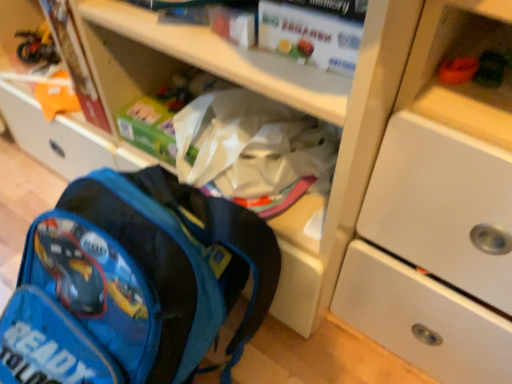
Where is `white matte paper at upper center, marked as the 2th paperback book in a left-to-right arrangement`? white matte paper at upper center, marked as the 2th paperback book in a left-to-right arrangement is located at coordinates (312, 32).

Measure the distance between point (480, 81) and camera.

They are 20.08 inches apart.

The height and width of the screenshot is (384, 512). Find the location of `white matte cabinet at upper right`. white matte cabinet at upper right is located at coordinates (440, 209).

This screenshot has width=512, height=384. What do you see at coordinates (76, 60) in the screenshot? I see `matte cardboard book at upper left, marked as the 2th paperback book in a front-to-back arrangement` at bounding box center [76, 60].

Locate an element on the screen. The image size is (512, 384). blue fabric backpack at lower left is located at coordinates (134, 283).

This screenshot has width=512, height=384. What do you see at coordinates (134, 283) in the screenshot?
I see `blue fabric backpack at lower left` at bounding box center [134, 283].

Locate an element on the screen. This screenshot has height=384, width=512. white matte paper at upper center, marked as the 2th paperback book in a left-to-right arrangement is located at coordinates (312, 32).

From the image's perspective, is matte cardboard book at upper left, the second paperback book viewed from the right, located above or below white matte paper at upper center, arranged as the 2th paperback book when viewed from the back?

matte cardboard book at upper left, the second paperback book viewed from the right, is above white matte paper at upper center, arranged as the 2th paperback book when viewed from the back.

Measure the distance between matte cardboard book at upper left, which ranks as the first paperback book in back-to-front order, and white matte paper at upper center, the 1th paperback book from the right.

14.28 inches.

Considering the relative sizes of matte cardboard book at upper left, marked as the 2th paperback book in a front-to-back arrangement, and white matte paper at upper center, the 1th paperback book from the right, in the image provided, is matte cardboard book at upper left, marked as the 2th paperback book in a front-to-back arrangement, bigger than white matte paper at upper center, the 1th paperback book from the right,?

Indeed, matte cardboard book at upper left, marked as the 2th paperback book in a front-to-back arrangement, has a larger size compared to white matte paper at upper center, the 1th paperback book from the right.

Is the surface of matte cardboard book at upper left, acting as the first paperback book starting from the left, in direct contact with white matte paper at upper center, the 1th paperback book from the right?

No, matte cardboard book at upper left, acting as the first paperback book starting from the left, is not next to white matte paper at upper center, the 1th paperback book from the right.

Between matte cardboard book at upper left, the second paperback book viewed from the right, and green fuzzy toy at upper right, which one is positioned in front?

green fuzzy toy at upper right is more forward.

In the scene shown: Is matte cardboard book at upper left, marked as the 2th paperback book in a front-to-back arrangement, touching green fuzzy toy at upper right?

No, matte cardboard book at upper left, marked as the 2th paperback book in a front-to-back arrangement, is not beside green fuzzy toy at upper right.

Is matte cardboard book at upper left, which ranks as the first paperback book in back-to-front order, to the left of green fuzzy toy at upper right from the viewer's perspective?

Yes, matte cardboard book at upper left, which ranks as the first paperback book in back-to-front order, is to the left of green fuzzy toy at upper right.

Is blue fabric backpack at lower left positioned far away from white matte cabinet at upper right?

No.

Is blue fabric backpack at lower left located outside white matte cabinet at upper right?

Yes, blue fabric backpack at lower left is not within white matte cabinet at upper right.

From the image's perspective, between blue fabric backpack at lower left and white matte cabinet at upper right, who is located below?

blue fabric backpack at lower left, from the image's perspective.

This screenshot has height=384, width=512. There is a blue fabric backpack at lower left. Find the location of `cabinetry above it (from a real-world perspective)`. cabinetry above it (from a real-world perspective) is located at coordinates (440, 209).

Looking at their sizes, would you say white matte paper at upper center, the first paperback book when ordered from front to back, is wider or thinner than green fuzzy toy at upper right?

In the image, white matte paper at upper center, the first paperback book when ordered from front to back, appears to be more narrow than green fuzzy toy at upper right.

Considering the points (355, 61) and (486, 73), which point is in front, point (355, 61) or point (486, 73)?

Positioned in front is point (355, 61).

Between white matte paper at upper center, the 1th paperback book from the right, and green fuzzy toy at upper right, which one has larger size?

Bigger between the two is white matte paper at upper center, the 1th paperback book from the right.

In terms of size, does white matte paper at upper center, arranged as the 2th paperback book when viewed from the back, appear bigger or smaller than matte cardboard book at upper left, the second paperback book viewed from the right?

Clearly, white matte paper at upper center, arranged as the 2th paperback book when viewed from the back, is smaller in size than matte cardboard book at upper left, the second paperback book viewed from the right.

Which is in front, point (262, 11) or point (87, 63)?

The point (262, 11) is more forward.

Is white matte paper at upper center, the 1th paperback book from the right, taller or shorter than matte cardboard book at upper left, marked as the 2th paperback book in a front-to-back arrangement?

In the image, white matte paper at upper center, the 1th paperback book from the right, appears to be shorter than matte cardboard book at upper left, marked as the 2th paperback book in a front-to-back arrangement.

Could you measure the distance between white matte paper at upper center, marked as the 2th paperback book in a left-to-right arrangement, and matte cardboard book at upper left, marked as the 2th paperback book in a front-to-back arrangement?

They are 14.28 inches apart.

Which is more to the right, green fuzzy toy at upper right or matte cardboard book at upper left, which ranks as the first paperback book in back-to-front order?

Positioned to the right is green fuzzy toy at upper right.

Is green fuzzy toy at upper right aimed at matte cardboard book at upper left, which ranks as the first paperback book in back-to-front order?

No.

Which object is closer to the camera, green fuzzy toy at upper right or matte cardboard book at upper left, acting as the first paperback book starting from the left?

green fuzzy toy at upper right is in front.

From the picture: From the image's perspective, which one is positioned higher, blue fabric backpack at lower left or white matte paper at upper center, the 1th paperback book from the right?

white matte paper at upper center, the 1th paperback book from the right, is shown above in the image.

Does blue fabric backpack at lower left lie in front of white matte paper at upper center, arranged as the 2th paperback book when viewed from the back?

That is True.

Could you measure the distance between blue fabric backpack at lower left and white matte paper at upper center, the first paperback book when ordered from front to back?

The distance of blue fabric backpack at lower left from white matte paper at upper center, the first paperback book when ordered from front to back, is 14.56 inches.

Is blue fabric backpack at lower left oriented towards white matte paper at upper center, the 1th paperback book from the right?

No, blue fabric backpack at lower left is not turned towards white matte paper at upper center, the 1th paperback book from the right.

Where is `paperback book to the right of matte cardboard book at upper left, which ranks as the first paperback book in back-to-front order`? This screenshot has width=512, height=384. paperback book to the right of matte cardboard book at upper left, which ranks as the first paperback book in back-to-front order is located at coordinates (312, 32).

Find the location of a particular element. paperback book beneath the green fuzzy toy at upper right (from a real-world perspective) is located at coordinates (76, 60).

Based on their spatial positions, is green fuzzy toy at upper right or matte cardboard book at upper left, acting as the first paperback book starting from the left, closer to white matte paper at upper center, marked as the 2th paperback book in a left-to-right arrangement?

green fuzzy toy at upper right lies closer to white matte paper at upper center, marked as the 2th paperback book in a left-to-right arrangement, than the other object.

Considering their positions, is white matte cabinet at upper right positioned closer to blue fabric backpack at lower left than green fuzzy toy at upper right?

Based on the image, white matte cabinet at upper right appears to be nearer to blue fabric backpack at lower left.

From the picture: Considering their positions, is matte cardboard book at upper left, which ranks as the first paperback book in back-to-front order, positioned closer to green fuzzy toy at upper right than white matte cabinet at upper right?

white matte cabinet at upper right is closer to green fuzzy toy at upper right.

Considering their positions, is matte cardboard book at upper left, acting as the first paperback book starting from the left, positioned closer to blue fabric backpack at lower left than white matte paper at upper center, arranged as the 2th paperback book when viewed from the back?

matte cardboard book at upper left, acting as the first paperback book starting from the left, lies closer to blue fabric backpack at lower left than the other object.

From the picture: Looking at the image, which one is located further to white matte paper at upper center, arranged as the 2th paperback book when viewed from the back, white matte cabinet at upper right or blue fabric backpack at lower left?

Based on the image, blue fabric backpack at lower left appears to be further to white matte paper at upper center, arranged as the 2th paperback book when viewed from the back.

From the image, which object appears to be nearer to matte cardboard book at upper left, which ranks as the first paperback book in back-to-front order, white matte paper at upper center, the 1th paperback book from the right, or blue fabric backpack at lower left?

Based on the image, blue fabric backpack at lower left appears to be nearer to matte cardboard book at upper left, which ranks as the first paperback book in back-to-front order.

When comparing their distances from blue fabric backpack at lower left, does white matte cabinet at upper right or matte cardboard book at upper left, the second paperback book viewed from the right, seem further?

Among the two, white matte cabinet at upper right is located further to blue fabric backpack at lower left.

Looking at the image, which one is located closer to blue fabric backpack at lower left, green fuzzy toy at upper right or white matte cabinet at upper right?

The object closer to blue fabric backpack at lower left is white matte cabinet at upper right.

Identify the location of backpack between matte cardboard book at upper left, the second paperback book viewed from the right, and white matte cabinet at upper right from left to right. (134, 283).

Find the location of `paperback book between blue fabric backpack at lower left and white matte cabinet at upper right`. paperback book between blue fabric backpack at lower left and white matte cabinet at upper right is located at coordinates (312, 32).

This screenshot has width=512, height=384. I want to click on backpack situated between matte cardboard book at upper left, acting as the first paperback book starting from the left, and green fuzzy toy at upper right from left to right, so click(x=134, y=283).

Image resolution: width=512 pixels, height=384 pixels. I want to click on paperback book located between blue fabric backpack at lower left and green fuzzy toy at upper right in the left-right direction, so click(x=312, y=32).